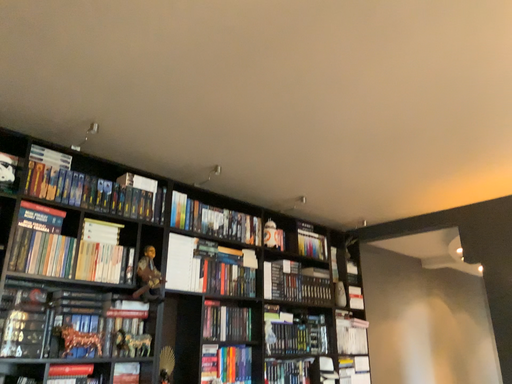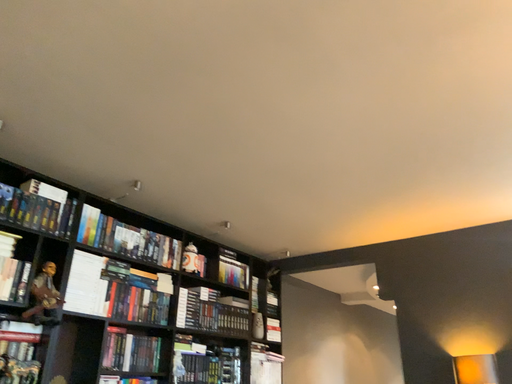
Question: How did the camera likely rotate when shooting the video?

Choices:
 (A) rotated right
 (B) rotated left

Answer: (A)